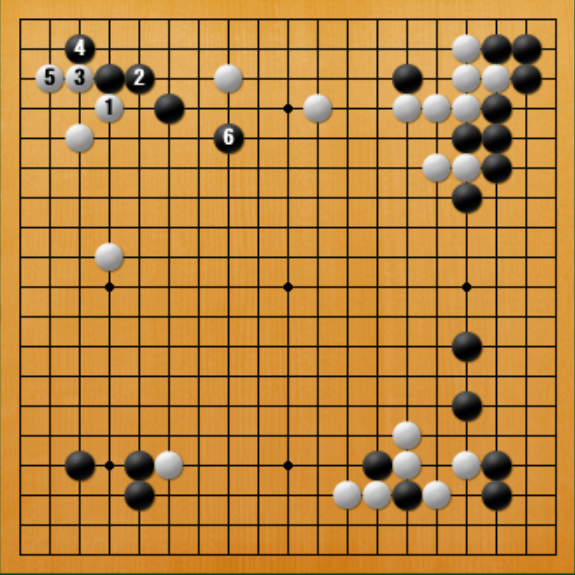
This screenshot has width=575, height=575. Find the location of `dots on game board`. dots on game board is located at coordinates (111, 285), (108, 461), (285, 461), (289, 286), (467, 282), (281, 105).